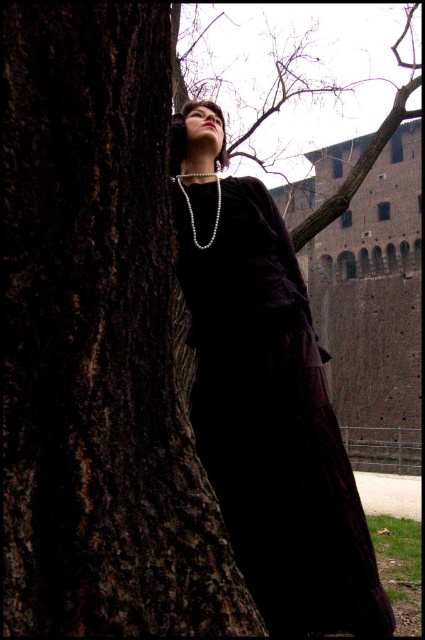
Does dark brown rough tree trunk at left appear on the left side of velvet dark dress at center?

Indeed, dark brown rough tree trunk at left is positioned on the left side of velvet dark dress at center.

Does dark brown rough tree trunk at left have a greater height compared to velvet dark dress at center?

Correct, dark brown rough tree trunk at left is much taller as velvet dark dress at center.

Is point (19, 561) in front of point (309, 493)?

Yes, it is.

The height and width of the screenshot is (640, 425). I want to click on dark brown rough tree trunk at left, so click(96, 342).